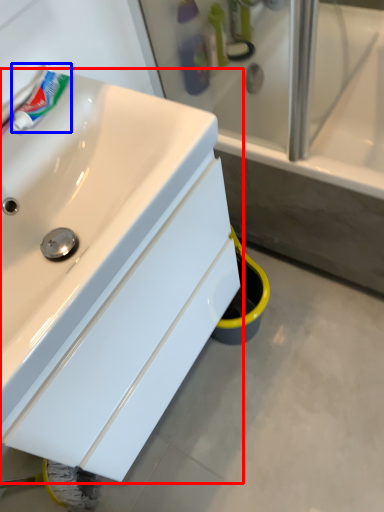
Question: Which point is closer to the camera, sink (highlighted by a red box) or toothpaste (highlighted by a blue box)?

Choices:
 (A) sink
 (B) toothpaste

Answer: (A)